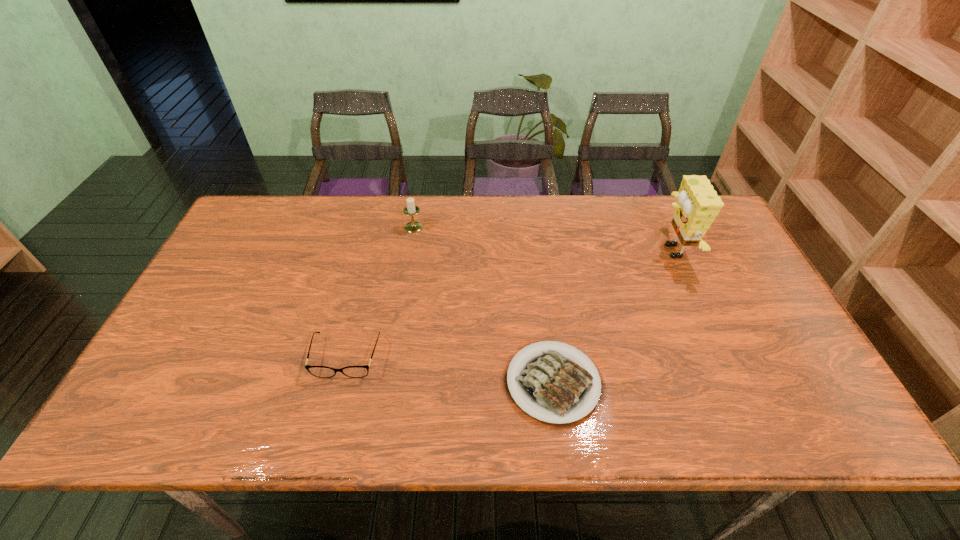
The image size is (960, 540). In order to click on empty location between the spectacles and the plate in this screenshot , I will do `click(449, 369)`.

Identify the location of vacant area between the shortest object and the sponge. The image size is (960, 540). (612, 317).

You are a GUI agent. You are given a task and a screenshot of the screen. Output one action in this format:
    pyautogui.click(x=<x>, y=<y>)
    Task: Click on the free spot between the second shortest object and the rightmost object
    This screenshot has height=540, width=960.
    Given the screenshot: What is the action you would take?
    pyautogui.click(x=509, y=304)

The width and height of the screenshot is (960, 540). I want to click on blank region between the candle holder and the third object from left to right, so click(x=484, y=305).

You are a GUI agent. You are given a task and a screenshot of the screen. Output one action in this format:
    pyautogui.click(x=<x>, y=<y>)
    Task: Click on the object that ranks as the closest to the spectacles
    The height and width of the screenshot is (540, 960).
    Given the screenshot: What is the action you would take?
    pyautogui.click(x=553, y=385)

Locate an element on the screen. The height and width of the screenshot is (540, 960). the second closest object to the spectacles is located at coordinates (411, 209).

The width and height of the screenshot is (960, 540). Find the location of `free space that satisfies the following two spatial constraints: 1. on the front-facing side of the plate; 2. on the right side of the leftmost object`. free space that satisfies the following two spatial constraints: 1. on the front-facing side of the plate; 2. on the right side of the leftmost object is located at coordinates (340, 383).

Image resolution: width=960 pixels, height=540 pixels. What are the coordinates of `free location that satisfies the following two spatial constraints: 1. on the front-facing side of the spectacles; 2. on the left side of the shortest object` in the screenshot? It's located at (340, 383).